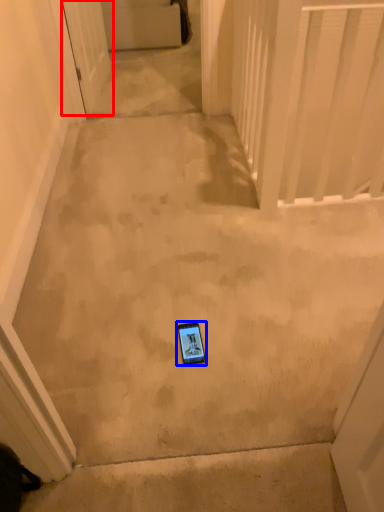
Question: Which object is closer to the camera taking this photo, door (highlighted by a red box) or mobile phone (highlighted by a blue box)?

Choices:
 (A) door
 (B) mobile phone

Answer: (B)